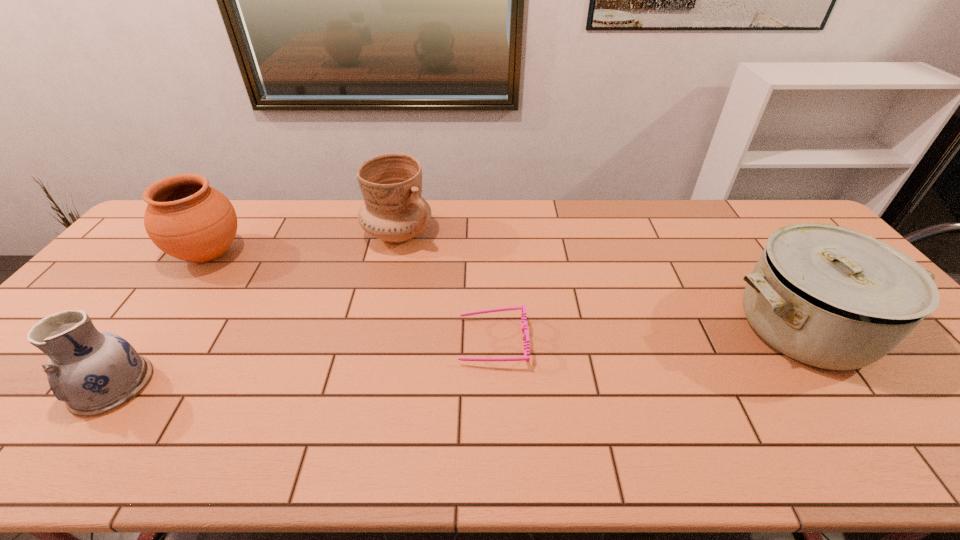
At what (x,y) coordinates should I click in order to perform the action: click on vacant space located on the arms of the fourth object from left to right. Please return your answer as a coordinate pair (x, y). The height and width of the screenshot is (540, 960). Looking at the image, I should click on (349, 341).

The image size is (960, 540). In order to click on object that is at the left edge in this screenshot , I will do `click(187, 219)`.

Locate an element on the screen. This screenshot has height=540, width=960. object located at the right edge is located at coordinates (831, 297).

The width and height of the screenshot is (960, 540). Identify the location of object present at the far left corner. (187, 219).

In the image, there is a desktop. Where is `free space at the far edge`? The height and width of the screenshot is (540, 960). free space at the far edge is located at coordinates (540, 226).

Where is `free spot between the saucepan and the shortest object`? The width and height of the screenshot is (960, 540). free spot between the saucepan and the shortest object is located at coordinates (648, 334).

The width and height of the screenshot is (960, 540). In order to click on vacant region between the nearest pottery and the rightmost pottery in this screenshot , I will do `click(255, 310)`.

Locate an element on the screen. The width and height of the screenshot is (960, 540). free space between the rightmost object and the third object from right to left is located at coordinates (601, 281).

Find the location of a particular element. Image resolution: width=960 pixels, height=540 pixels. empty space between the saucepan and the third object from left to right is located at coordinates (601, 281).

You are a GUI agent. You are given a task and a screenshot of the screen. Output one action in this format:
    pyautogui.click(x=<x>, y=<y>)
    Task: Click on the object that is the second closest to the rightmost object
    Image resolution: width=960 pixels, height=540 pixels.
    Given the screenshot: What is the action you would take?
    pyautogui.click(x=393, y=211)